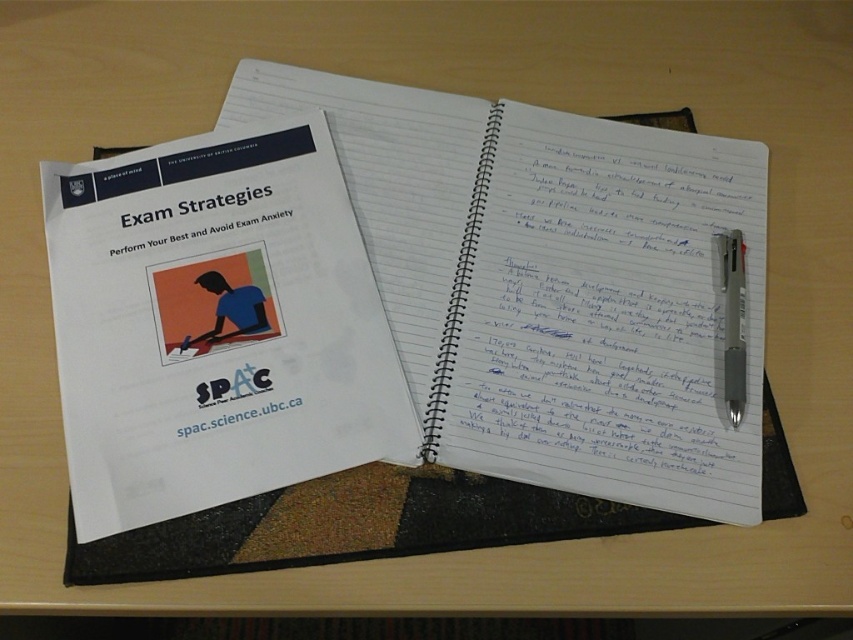
Question: Observing the image, what is the correct spatial positioning of white lined paper at center in reference to silver metallic pen at upper right?

Choices:
 (A) above
 (B) below

Answer: (A)

Question: From the image, what is the correct spatial relationship of white lined paper at center in relation to silver metallic pen at upper right?

Choices:
 (A) left
 (B) right

Answer: (A)

Question: Is white lined paper at center above silver metallic pen at upper right?

Choices:
 (A) no
 (B) yes

Answer: (B)

Question: Which of the following is the closest to the observer?

Choices:
 (A) white lined paper at center
 (B) silver metallic pen at upper right

Answer: (A)